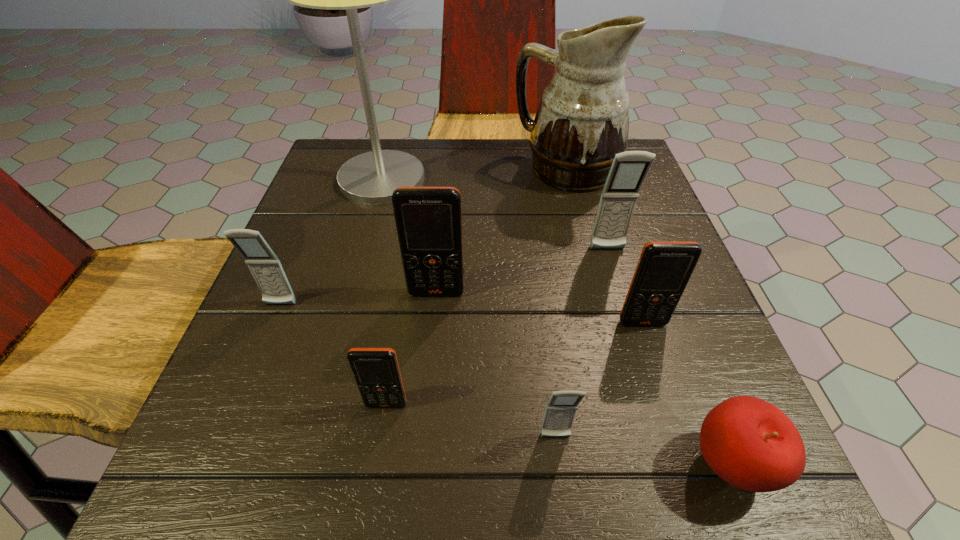
Find the location of a particular element. vacant space that satisfies the following two spatial constraints: 1. from the spout of the second tallest object; 2. on the front-facing side of the nearest gray cellular telephone is located at coordinates (633, 437).

Locate an element on the screen. The image size is (960, 540). vacant space that satisfies the following two spatial constraints: 1. on the front-facing side of the red apple; 2. on the left side of the second smallest gray cellular telephone is located at coordinates (215, 464).

In order to click on vacant space that satisfies the following two spatial constraints: 1. on the screen of the shortest object; 2. on the left side of the nearest orange cellular telephone in this screenshot , I will do `click(377, 464)`.